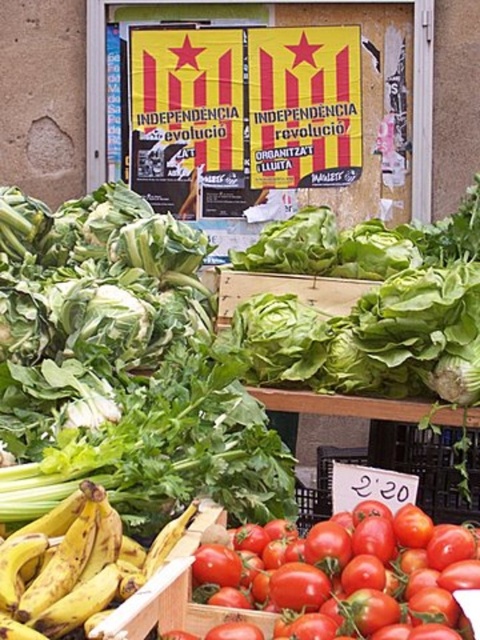
Is yellowstriped fabricposter at upper center closer to camera compared to yellow matte bananas at lower left?

No, yellowstriped fabricposter at upper center is behind yellow matte bananas at lower left.

Who is more distant from viewer, [197,131] or [136,545]?

Positioned behind is point [197,131].

Image resolution: width=480 pixels, height=640 pixels. Describe the element at coordinates (252, 100) in the screenshot. I see `yellowstriped fabricposter at upper center` at that location.

What are the coordinates of `yellowstriped fabricposter at upper center` in the screenshot? It's located at (252, 100).

Does yellowstriped fabricposter at upper center have a greater height compared to shiny red tomato at lower center?

Correct, yellowstriped fabricposter at upper center is much taller as shiny red tomato at lower center.

Between yellowstriped fabricposter at upper center and shiny red tomato at lower center, which one appears on the right side from the viewer's perspective?

From the viewer's perspective, shiny red tomato at lower center appears more on the right side.

Locate an element on the screen. This screenshot has height=640, width=480. yellowstriped fabricposter at upper center is located at coordinates (252, 100).

You are a GUI agent. You are given a task and a screenshot of the screen. Output one action in this format:
    pyautogui.click(x=<x>, y=<y>)
    Task: Click on the yellowstriped fabricposter at upper center
    This screenshot has height=640, width=480.
    Given the screenshot: What is the action you would take?
    pyautogui.click(x=252, y=100)

Who is taller, shiny red tomato at lower center or yellow matte bananas at lower left?

yellow matte bananas at lower left

Locate an element on the screen. shiny red tomato at lower center is located at coordinates (348, 566).

What do you see at coordinates (348, 566) in the screenshot? The width and height of the screenshot is (480, 640). I see `shiny red tomato at lower center` at bounding box center [348, 566].

Find the location of a particular element. Image resolution: width=480 pixels, height=640 pixels. shiny red tomato at lower center is located at coordinates (348, 566).